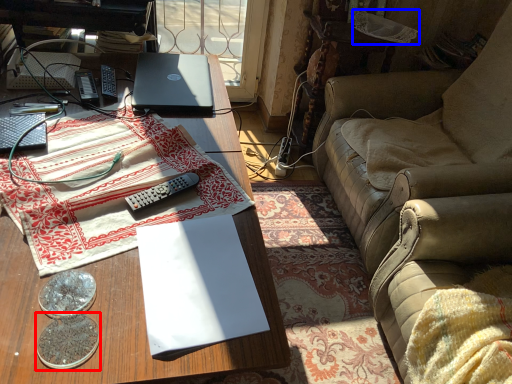
Question: Which of the following is the closest to the observer, coin (highlighted by a red box) or fabric (highlighted by a blue box)?

Choices:
 (A) coin
 (B) fabric

Answer: (A)